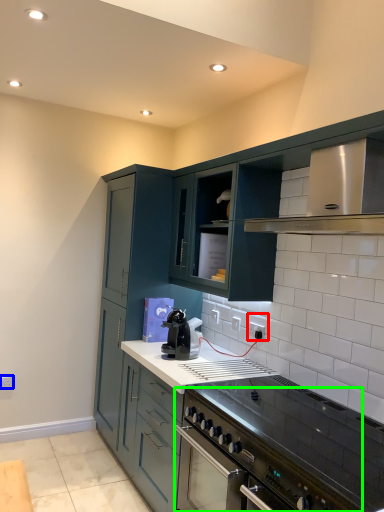
Question: Based on their relative distances, which object is farther from electric outlet (highlighted by a red box)? Choose from electric outlet (highlighted by a blue box) and kitchen appliance (highlighted by a green box).

Choices:
 (A) electric outlet
 (B) kitchen appliance

Answer: (A)